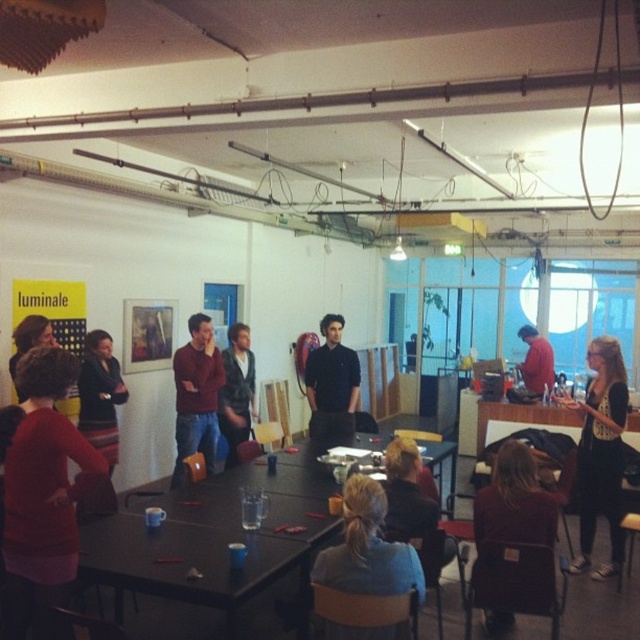
You are a photographer standing at the entrance of the room. You want to take a photo that includes both the striped skirt at left and the matte red shirt at center. What is the minimum distance you need to move backward to ensure both subjects are fully in frame?

The striped skirt at left and matte red shirt at center are 4.87 meters apart. To include both in the frame, you need to move back at least 4.87 meters to ensure the entire distance between them fits within your camera view.

You are organizing a photo shoot and need to decide which sweater to use as a prop. Both the black textured sweater at center and the matte brown sweater at center are available. Based on their sizes, which sweater would be more suitable for a model with a larger frame?

The black textured sweater at center has a larger size compared to the matte brown sweater at center, making it more suitable for a model with a larger frame.

You are standing at point (x=189, y=400) and want to walk to the door located at point (x=604, y=404). Which direction should you move to reach the door?

You should move forward because point (x=604, y=404) is in front of point (x=189, y=400).